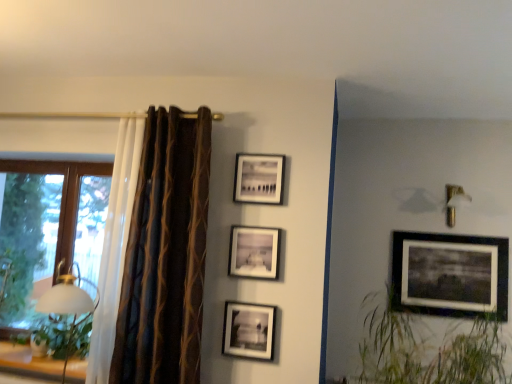
Question: Does point (243, 261) appear closer or farther from the camera than point (192, 332)?

Choices:
 (A) closer
 (B) farther

Answer: (B)

Question: Considering the positions of matte black picture frame at center, which is counted as the 2th picture frame, starting from the front, and brown striped curtain at left in the image, is matte black picture frame at center, which is counted as the 2th picture frame, starting from the front, bigger or smaller than brown striped curtain at left?

Choices:
 (A) small
 (B) big

Answer: (A)

Question: Estimate the real-world distances between objects in this image. Which object is closer to the white glossy table lamp at left?

Choices:
 (A) matte black picture frame at right, which is the 4th picture frame from left to right
 (B) matte black picture frame at center, which is counted as the 2th picture frame, starting from the front
 (C) wooden frame window at left
 (D) green leafy plant at left
 (E) matte black picture frame at center, the 4th picture frame positioned from the right

Answer: (D)

Question: Considering the real-world distances, which object is farthest from the white glossy table lamp at left?

Choices:
 (A) matte black picture frame at upper center, which is the second picture frame in right-to-left order
 (B) matte black picture frame at center, arranged as the third picture frame when viewed from the back
 (C) brown striped curtain at left
 (D) matte black picture frame at center, the fourth picture frame in the back-to-front sequence
 (E) green grass at right

Answer: (E)